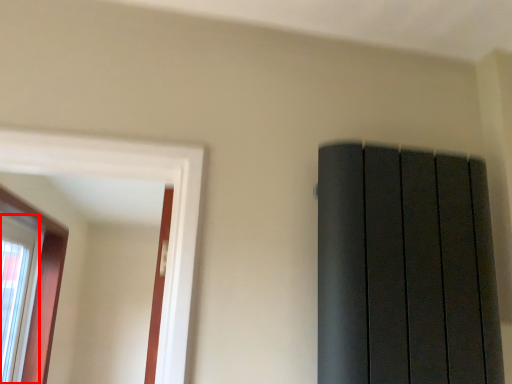
Question: From the image's perspective, what is the correct spatial relationship of window (annotated by the red box) in relation to window?

Choices:
 (A) below
 (B) above

Answer: (A)